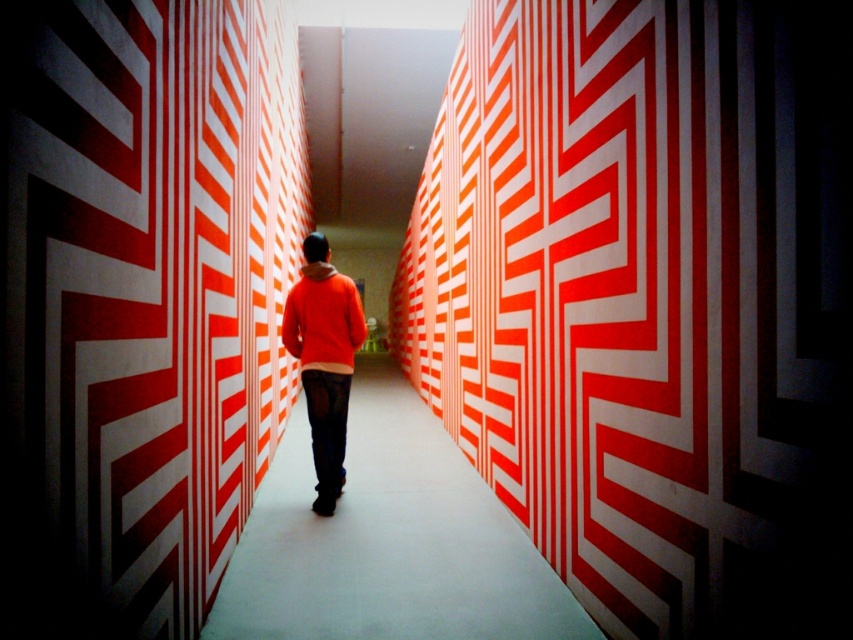
Is point (444, 500) closer to camera compared to point (315, 324)?

No, it is behind (315, 324).

Is point (320, 522) positioned in front of point (305, 340)?

Yes.

Image resolution: width=853 pixels, height=640 pixels. Identify the location of matte orange wall at center. (387, 540).

Which is behind, point (334, 522) or point (341, 467)?

The point (341, 467) is behind.

Looking at this image, measure the distance from matte orange wall at center to orange matte sweater at center.

matte orange wall at center is 1.44 meters away from orange matte sweater at center.

What do you see at coordinates (387, 540) in the screenshot? I see `matte orange wall at center` at bounding box center [387, 540].

The height and width of the screenshot is (640, 853). Identify the location of matte orange wall at center. (387, 540).

Is orange matte sweater at center below orange fleece sweatshirt at center?

Yes.

From the picture: Is orange matte sweater at center to the left of orange fleece sweatshirt at center from the viewer's perspective?

In fact, orange matte sweater at center is to the right of orange fleece sweatshirt at center.

Where is `orange matte sweater at center`? orange matte sweater at center is located at coordinates (323, 358).